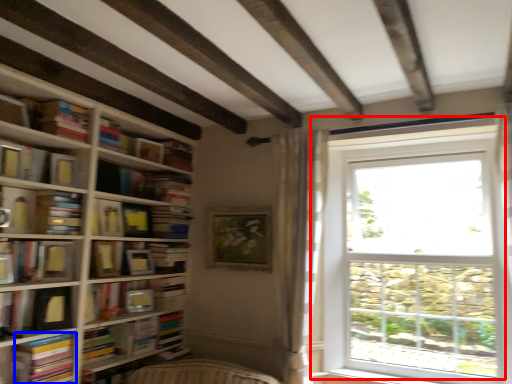
Question: Which of the following is the closest to the observer, window (highlighted by a red box) or paperback book (highlighted by a blue box)?

Choices:
 (A) window
 (B) paperback book

Answer: (B)